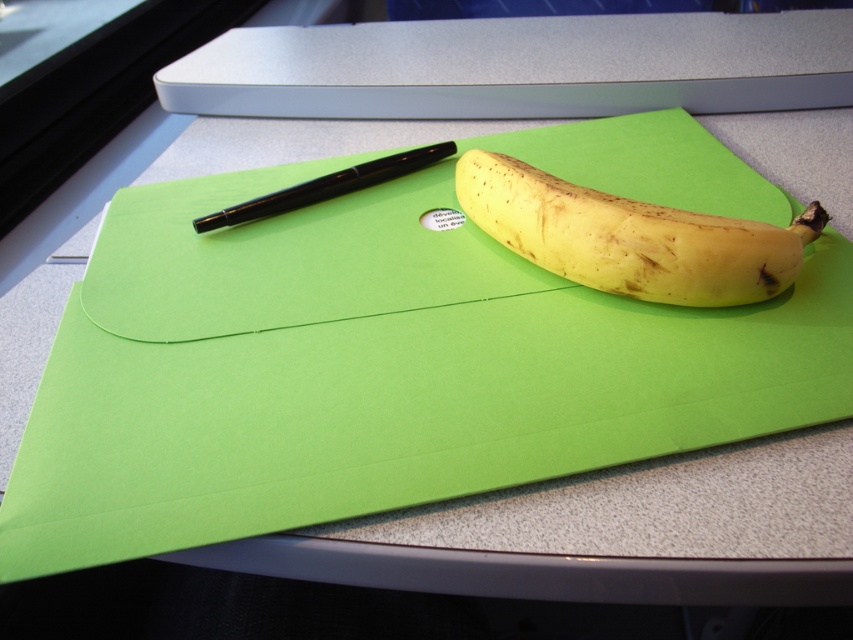
You are organizing items on your desk and want to place the green paper at center and the black glossy pen at upper left side by side. Which item requires more horizontal space to fit properly?

The green paper at center requires more horizontal space because its width surpasses that of the black glossy pen at upper left.

What object is located at the coordinate point (630, 236) on the desk?

The yellow matte banana at center is located at the coordinate point (630, 236) on the desk.

You are organizing your desk and need to place both the green paper at center and the yellow matte banana at center. Since you want to ensure they both fit on the desk, can you determine which object should be placed first based on their sizes?

The green paper at center is larger in size than the yellow matte banana at center, so you should place the larger green paper at center first to ensure there is enough space for both items.